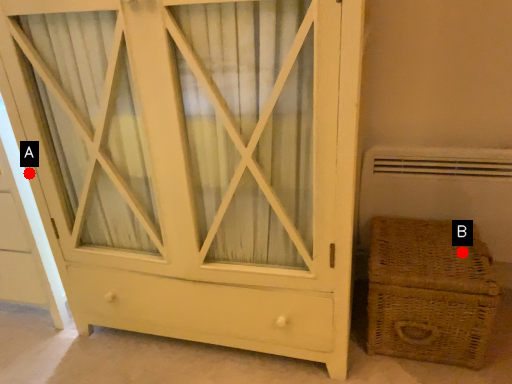
Question: Two points are circled on the image, labeled by A and B beside each circle. Which point appears closest to the camera in this image?

Choices:
 (A) A is closer
 (B) B is closer

Answer: (B)